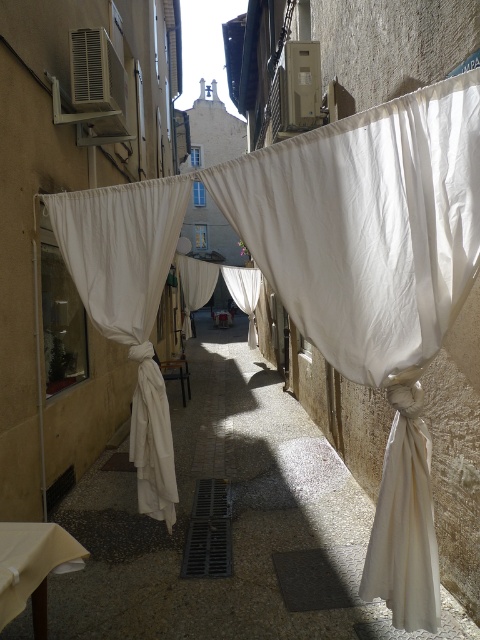
Does white fabric at center have a greater width compared to white cotton curtain at left?

Correct, the width of white fabric at center exceeds that of white cotton curtain at left.

Is point (336, 596) positioned in front of point (82, 296)?

Yes, point (336, 596) is closer to viewer.

In order to click on white fabric at center in this screenshot , I will do `click(231, 522)`.

Who is shorter, white fabric at center or white sheer curtain at center?

Standing shorter between the two is white fabric at center.

Identify the location of white fabric at center. The width and height of the screenshot is (480, 640). click(x=231, y=522).

What are the coordinates of `white fabric at center` in the screenshot? It's located at (231, 522).

Is white cotton curtain at left closer to the viewer compared to white sheer curtain at center?

Yes, white cotton curtain at left is in front of white sheer curtain at center.

What do you see at coordinates (129, 301) in the screenshot? This screenshot has width=480, height=640. I see `white cotton curtain at left` at bounding box center [129, 301].

You are a GUI agent. You are given a task and a screenshot of the screen. Output one action in this format:
    pyautogui.click(x=<x>, y=<y>)
    Task: Click on the white cotton curtain at left
    The image size is (480, 640).
    Given the screenshot: What is the action you would take?
    pyautogui.click(x=129, y=301)